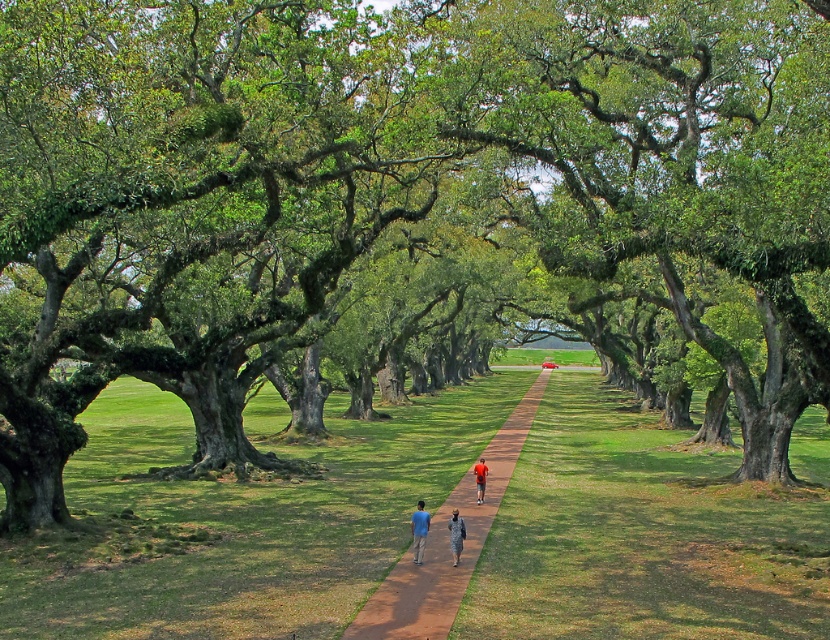
Which is more to the left, blue cotton shirt at center or orange fabric person at center?

blue cotton shirt at center

Between blue cotton shirt at center and orange fabric person at center, which one is positioned higher?

blue cotton shirt at center

Does point (423, 545) lie in front of point (479, 472)?

Yes, point (423, 545) is closer to viewer.

The image size is (830, 640). In order to click on blue cotton shirt at center in this screenshot , I will do `click(418, 531)`.

Does green mossy tree at center appear under brown dirt path at center?

Incorrect, green mossy tree at center is not positioned below brown dirt path at center.

Is green mossy tree at center positioned in front of brown dirt path at center?

No.

At what (x,y) coordinates should I click in order to perform the action: click on green mossy tree at center. Please return your answer as a coordinate pair (x, y). Looking at the image, I should click on (674, 172).

Who is positioned more to the right, brown dirt path at center or blue cotton shirt at center?

brown dirt path at center

Find the location of a particular element. Image resolution: width=830 pixels, height=640 pixels. brown dirt path at center is located at coordinates (447, 545).

Which is behind, point (367, 620) or point (411, 515)?

Positioned behind is point (411, 515).

You are a GUI agent. You are given a task and a screenshot of the screen. Output one action in this format:
    pyautogui.click(x=<x>, y=<y>)
    Task: Click on the brown dirt path at center
    The image size is (830, 640).
    Given the screenshot: What is the action you would take?
    click(x=447, y=545)